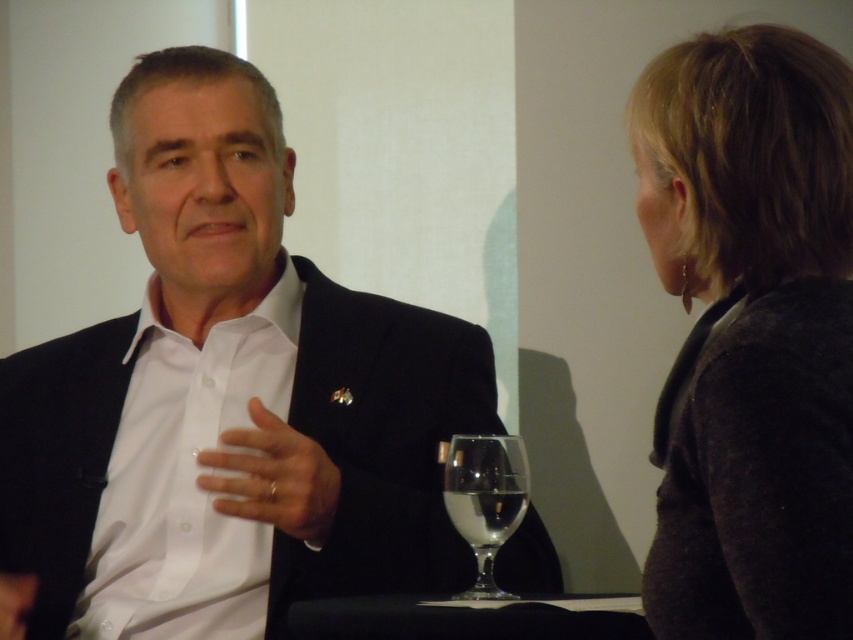
Question: Which object is positioned farthest from the black glass table at center?

Choices:
 (A) dark gray sweater at upper right
 (B) clear glass wine at center
 (C) black matte suit at center
 (D) clear glass wine glass at center

Answer: (A)

Question: Is black matte suit at center further to camera compared to clear glass wine glass at center?

Choices:
 (A) no
 (B) yes

Answer: (B)

Question: Which object appears closest to the camera in this image?

Choices:
 (A) clear glass wine glass at center
 (B) black matte suit at center
 (C) clear glass wine at center
 (D) black glass table at center

Answer: (D)

Question: Does clear glass wine glass at center appear on the right side of clear glass wine at center?

Choices:
 (A) no
 (B) yes

Answer: (A)

Question: Can you confirm if black glass table at center is smaller than clear glass wine glass at center?

Choices:
 (A) yes
 (B) no

Answer: (B)

Question: Which object is positioned farthest from the clear glass wine at center?

Choices:
 (A) clear glass wine glass at center
 (B) black matte suit at center
 (C) dark gray sweater at upper right
 (D) black glass table at center

Answer: (B)